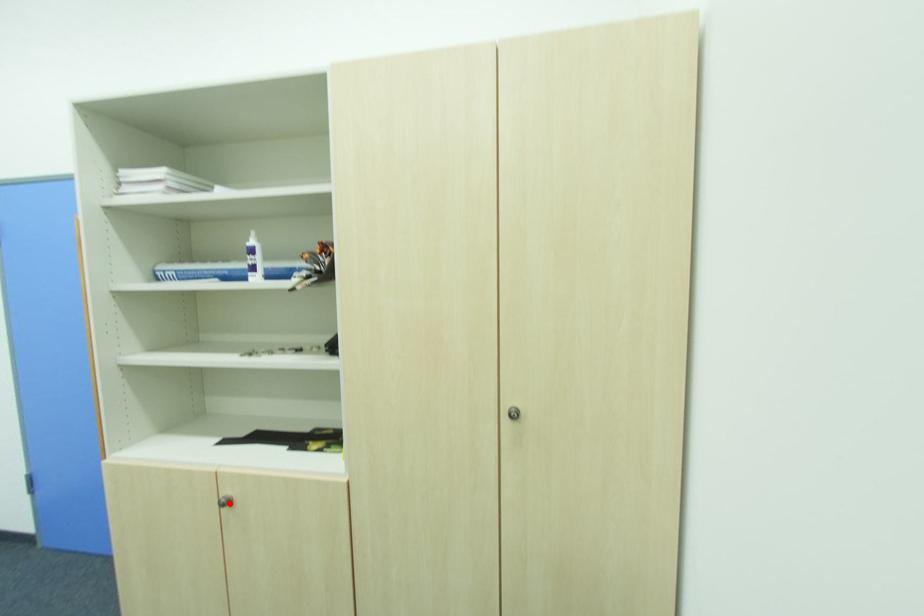
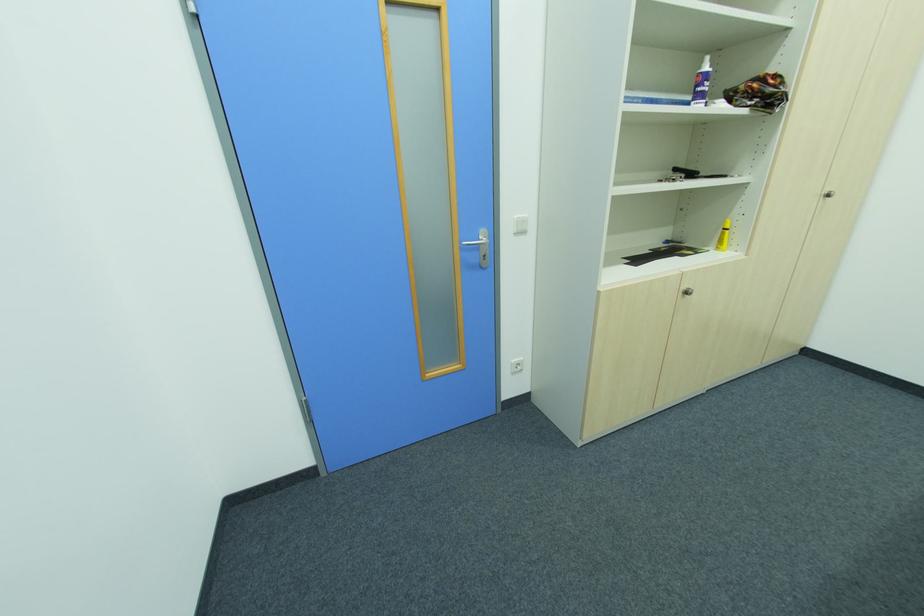
Find the pixel in the second image that matches the highlighted location in the first image.

(689, 294)